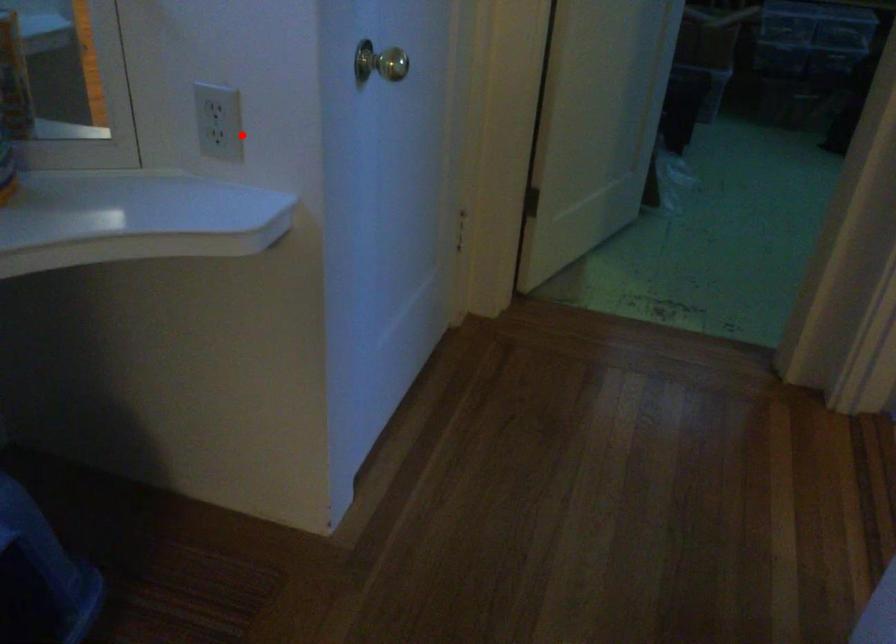
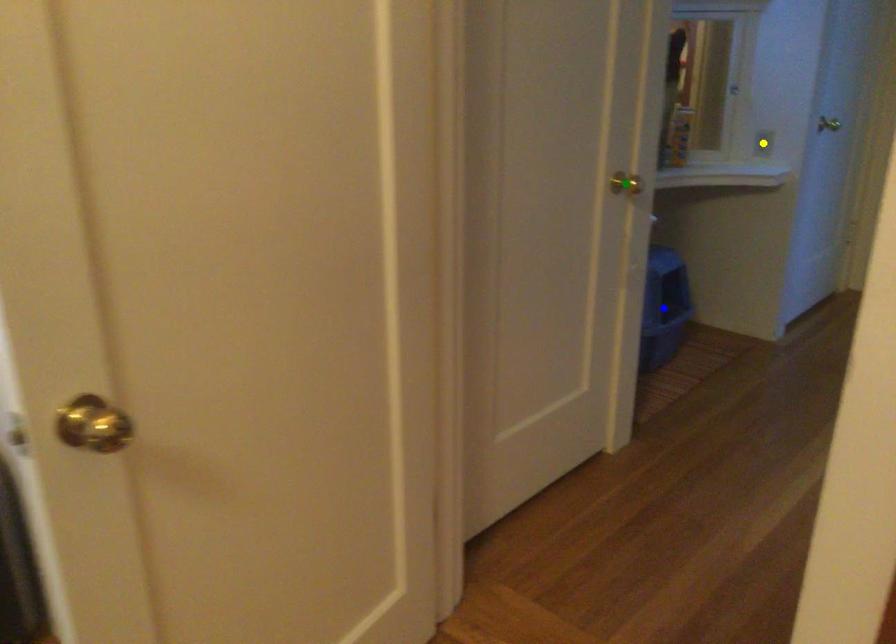
Question: I am providing you with two images of the same scene from different viewpoints. A red point is marked on the first image. You are given multiple points on the second image. Which spot in image 2 lines up with the point in image 1?

Choices:
 (A) yellow point
 (B) blue point
 (C) green point

Answer: (A)